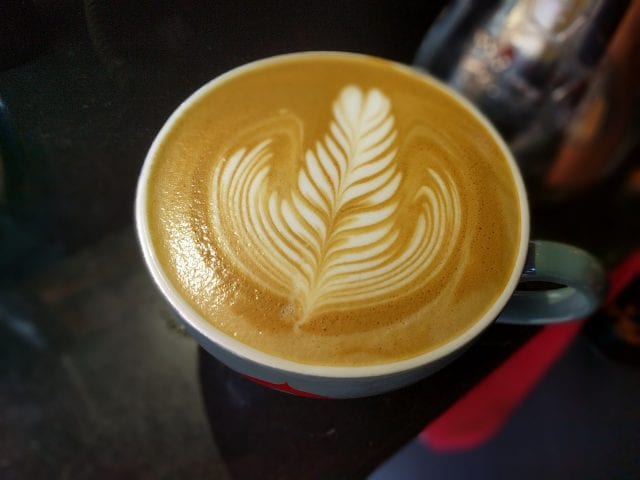
You are a GUI agent. You are given a task and a screenshot of the screen. Output one action in this format:
    pyautogui.click(x=<x>, y=<y>)
    Task: Click on the handle
    
    Given the screenshot: What is the action you would take?
    pyautogui.click(x=566, y=280)